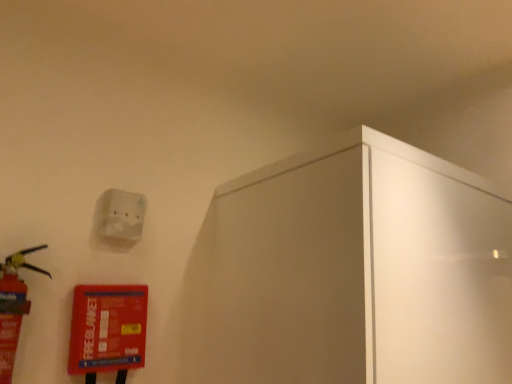
Question: In terms of size, does white matte light switch at upper left appear bigger or smaller than red plastic extinguisher at left?

Choices:
 (A) small
 (B) big

Answer: (A)

Question: Does point (123, 231) appear closer or farther from the camera than point (11, 360)?

Choices:
 (A) closer
 (B) farther

Answer: (B)

Question: Would you say white matte light switch at upper left is inside or outside red plastic extinguisher at left?

Choices:
 (A) inside
 (B) outside

Answer: (B)

Question: Looking at their shapes, would you say red plastic extinguisher at left is wider or thinner than white matte light switch at upper left?

Choices:
 (A) thin
 (B) wide

Answer: (B)

Question: From a real-world perspective, is red plastic extinguisher at left physically located above or below white matte light switch at upper left?

Choices:
 (A) below
 (B) above

Answer: (A)

Question: From the image's perspective, relative to white matte light switch at upper left, is red plastic extinguisher at left above or below?

Choices:
 (A) above
 (B) below

Answer: (B)

Question: In the image, is red plastic extinguisher at left positioned in front of or behind white matte light switch at upper left?

Choices:
 (A) behind
 (B) front

Answer: (B)